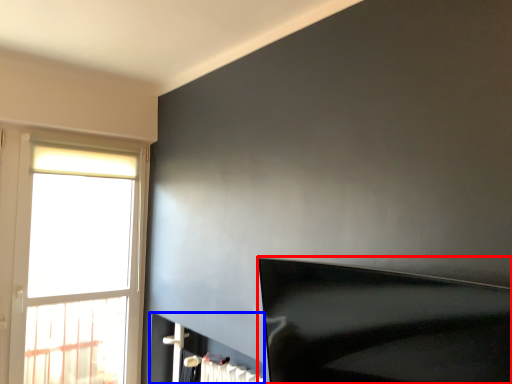
Question: Which object is further to the camera taking this photo, furniture (highlighted by a red box) or fireplace (highlighted by a blue box)?

Choices:
 (A) furniture
 (B) fireplace

Answer: (B)